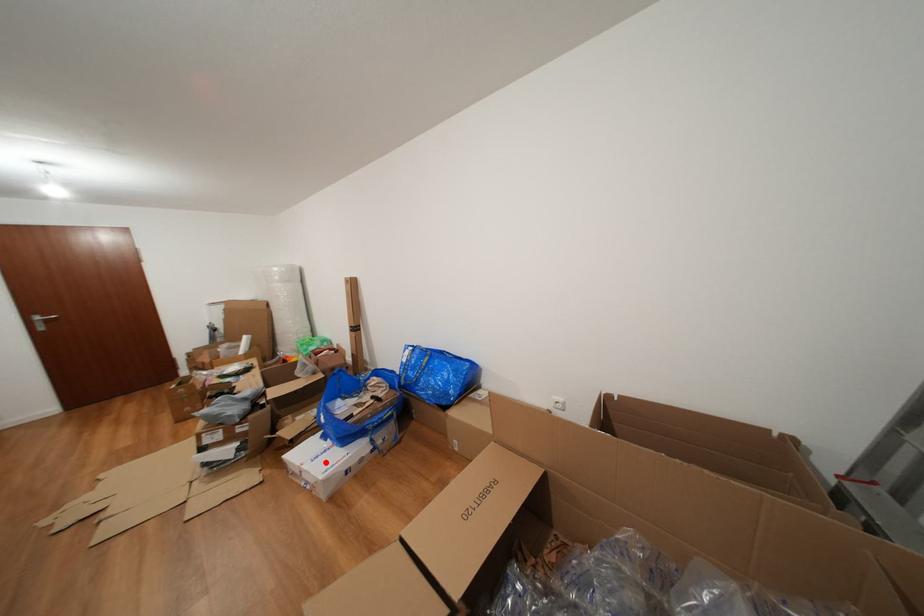
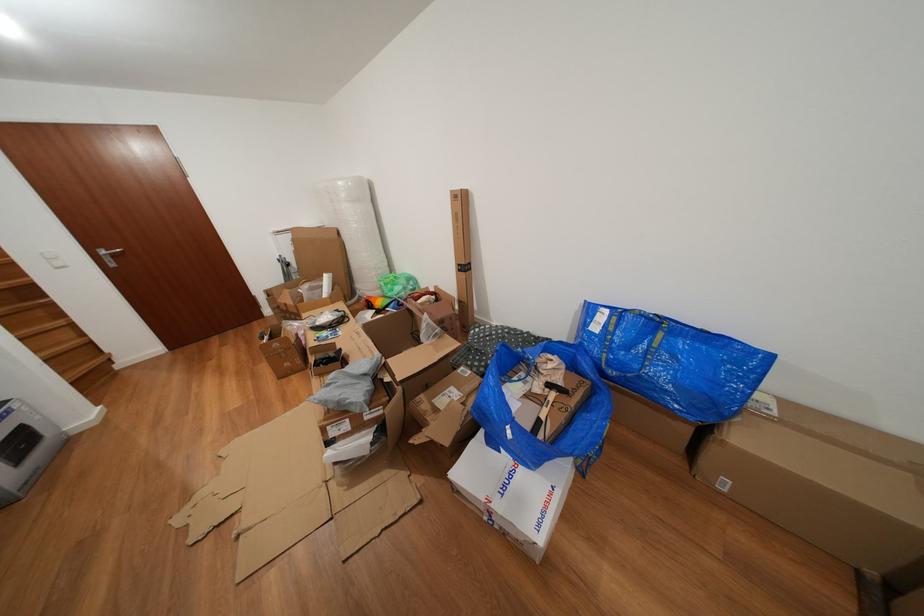
The point at the highlighted location is marked in the first image. Where is the corresponding point in the second image?

(513, 493)